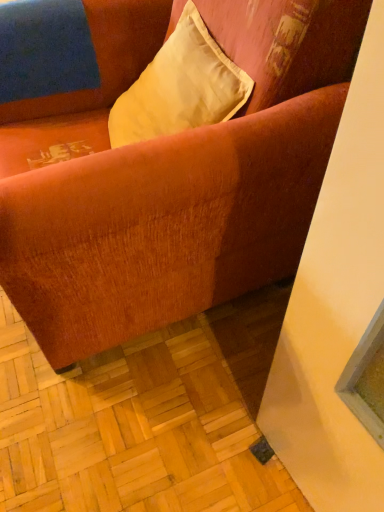
At what (x,y) coordinates should I click in order to perform the action: click on satin yellow pillow at upper center. Please return your answer as a coordinate pair (x, y). This screenshot has height=512, width=384. Looking at the image, I should click on (180, 87).

In order to face satin yellow pillow at upper center, should I rotate leftwards or rightwards?

To face it directly, rotate left by 3.472 degrees.

Describe the element at coordinates (180, 87) in the screenshot. I see `satin yellow pillow at upper center` at that location.

Identify the location of velvet orange couch at center. This screenshot has width=384, height=512. (171, 178).

Measure the distance between velvet orange couch at center and camera.

25.12 inches.

The image size is (384, 512). Describe the element at coordinates (171, 178) in the screenshot. I see `velvet orange couch at center` at that location.

What are the coordinates of `satin yellow pillow at upper center` in the screenshot? It's located at (180, 87).

Based on the photo, does velvet orange couch at center appear on the left side of satin yellow pillow at upper center?

Yes.

Is velvet orange couch at center closer to camera compared to satin yellow pillow at upper center?

Yes.

Which point is more distant from viewer, [345,83] or [108,124]?

Positioned behind is point [108,124].

From the image's perspective, which is below, velvet orange couch at center or satin yellow pillow at upper center?

velvet orange couch at center is shown below in the image.

From a real-world perspective, which object rests below the other?

In real-world perspective, velvet orange couch at center is lower.

Considering the sizes of objects velvet orange couch at center and satin yellow pillow at upper center in the image provided, who is wider, velvet orange couch at center or satin yellow pillow at upper center?

velvet orange couch at center is wider.

Consider the image. Between velvet orange couch at center and satin yellow pillow at upper center, which one has more height?

With more height is velvet orange couch at center.

Can you confirm if velvet orange couch at center is bigger than satin yellow pillow at upper center?

Correct, velvet orange couch at center is larger in size than satin yellow pillow at upper center.

Can satin yellow pillow at upper center be found inside velvet orange couch at center?

That's correct, satin yellow pillow at upper center is inside velvet orange couch at center.

Are velvet orange couch at center and satin yellow pillow at upper center located far from each other?

Actually, velvet orange couch at center and satin yellow pillow at upper center are a little close together.

Is velvet orange couch at center oriented towards satin yellow pillow at upper center?

Yes, velvet orange couch at center is turned towards satin yellow pillow at upper center.

How many degrees apart are the facing directions of velvet orange couch at center and satin yellow pillow at upper center?

velvet orange couch at center and satin yellow pillow at upper center are facing 9.75 degrees away from each other.

Measure the distance between velvet orange couch at center and satin yellow pillow at upper center.

velvet orange couch at center is 7.94 inches from satin yellow pillow at upper center.

At what (x,y) coordinates should I click in order to perform the action: click on studio couch lying below the satin yellow pillow at upper center (from the image's perspective). Please return your answer as a coordinate pair (x, y). Image resolution: width=384 pixels, height=512 pixels. Looking at the image, I should click on (171, 178).

In the image, is satin yellow pillow at upper center on the left side or the right side of velvet orange couch at center?

From the image, it's evident that satin yellow pillow at upper center is to the right of velvet orange couch at center.

Considering the relative positions of satin yellow pillow at upper center and velvet orange couch at center in the image provided, is satin yellow pillow at upper center behind velvet orange couch at center?

Yes.

Which is further, (212,82) or (207,20)?

The point (207,20) is more distant.

From the image's perspective, which is above, satin yellow pillow at upper center or velvet orange couch at center?

satin yellow pillow at upper center.

From a real-world perspective, is satin yellow pillow at upper center physically above velvet orange couch at center?

Indeed, from a real-world perspective, satin yellow pillow at upper center stands above velvet orange couch at center.

Looking at their sizes, would you say satin yellow pillow at upper center is wider or thinner than velvet orange couch at center?

Considering their sizes, satin yellow pillow at upper center looks slimmer than velvet orange couch at center.

Who is taller, satin yellow pillow at upper center or velvet orange couch at center?

Standing taller between the two is velvet orange couch at center.

Looking at the image, does satin yellow pillow at upper center seem bigger or smaller compared to velvet orange couch at center?

In the image, satin yellow pillow at upper center appears to be smaller than velvet orange couch at center.

Is satin yellow pillow at upper center outside of velvet orange couch at center?

No, most part of satin yellow pillow at upper center lies within velvet orange couch at center.

Is satin yellow pillow at upper center far away from velvet orange couch at center?

No, satin yellow pillow at upper center is not far away from velvet orange couch at center.

Is satin yellow pillow at upper center looking in the opposite direction of velvet orange couch at center?

Yes, velvet orange couch at center is at the back of satin yellow pillow at upper center.

How distant is satin yellow pillow at upper center from velvet orange couch at center?

satin yellow pillow at upper center and velvet orange couch at center are 7.94 inches apart.

This screenshot has width=384, height=512. I want to click on pillow that appears above the velvet orange couch at center (from the image's perspective), so click(x=180, y=87).

In the image, there is a satin yellow pillow at upper center. At what (x,y) coordinates should I click in order to perform the action: click on studio couch below it (from the image's perspective). Please return your answer as a coordinate pair (x, y). Looking at the image, I should click on (171, 178).

At what (x,y) coordinates should I click in order to perform the action: click on pillow that appears above the velvet orange couch at center (from the image's perspective). Please return your answer as a coordinate pair (x, y). The width and height of the screenshot is (384, 512). Looking at the image, I should click on (180, 87).